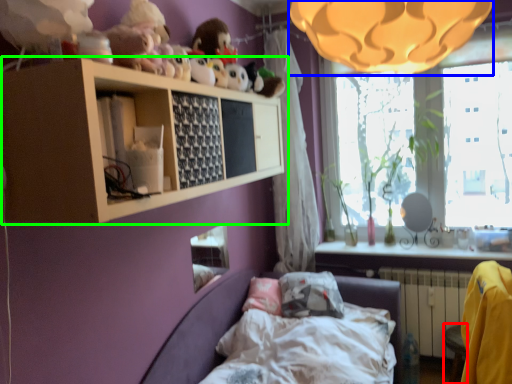
Question: Considering the real-world distances, which object is closest to furniture (highlighted by a red box)? lamp (highlighted by a blue box) or shelf (highlighted by a green box).

Choices:
 (A) lamp
 (B) shelf

Answer: (B)